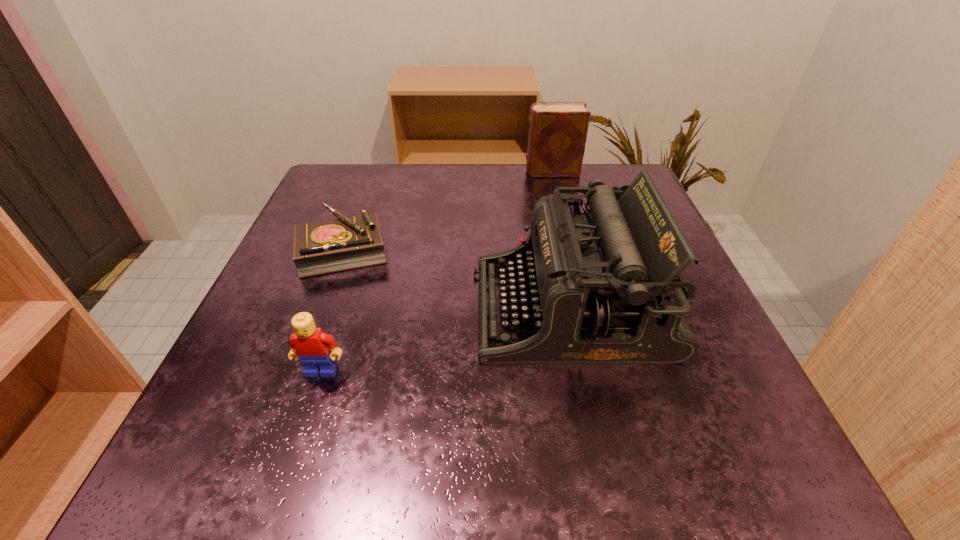
This screenshot has height=540, width=960. I want to click on free area in between the taller diary and the second shortest object, so click(437, 271).

The image size is (960, 540). Find the location of `empty location between the tallest object and the Lego`. empty location between the tallest object and the Lego is located at coordinates (446, 340).

The height and width of the screenshot is (540, 960). I want to click on free space that is in between the tallest object and the Lego, so click(446, 340).

At what (x,y) coordinates should I click in order to perform the action: click on vacant area that lies between the third tallest object and the shortest object. Please return your answer as a coordinate pair (x, y). Looking at the image, I should click on (332, 310).

Select which object is the closest to the second shortest object. Please provide its 2D coordinates. Your answer should be formatted as a tuple, i.e. [(x, y)], where the tuple contains the x and y coordinates of a point satisfying the conditions above.

[(605, 286)]

This screenshot has width=960, height=540. In order to click on the third closest object to the tallest object in this screenshot , I will do `click(557, 135)`.

Find the location of `free space in the image that satisfies the following two spatial constraints: 1. on the spine side of the farthest object; 2. on the face of the Lego`. free space in the image that satisfies the following two spatial constraints: 1. on the spine side of the farthest object; 2. on the face of the Lego is located at coordinates (601, 371).

I want to click on vacant point that satisfies the following two spatial constraints: 1. on the spine side of the right diary; 2. on the front side of the shortest object, so click(x=571, y=249).